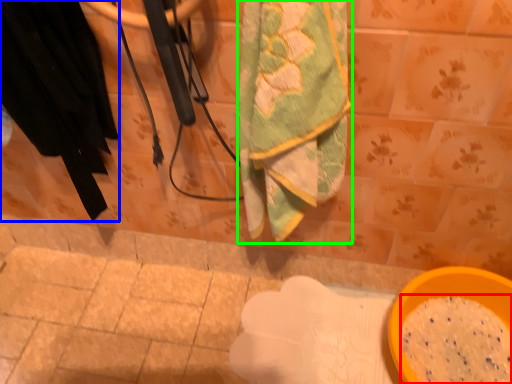
Question: Based on their relative distances, which object is nearer to powder (highlighted by a red box)? Choose from clothing (highlighted by a blue box) and towel (highlighted by a green box).

Choices:
 (A) clothing
 (B) towel

Answer: (B)